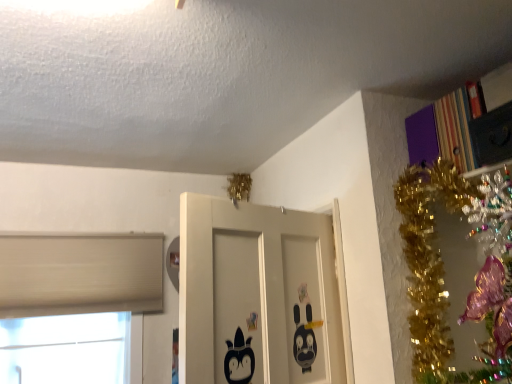
Where is `white matte window at lower left`? This screenshot has width=512, height=384. white matte window at lower left is located at coordinates (80, 273).

The image size is (512, 384). I want to click on black matte door at center, so click(x=256, y=290).

Would you say striped cardboard bookcase at upper right is a long distance from black matte door at center?

No.

From a real-world perspective, is striped cardboard bookcase at upper right located beneath black matte door at center?

No, from a real-world perspective, striped cardboard bookcase at upper right is not under black matte door at center.

Would you say striped cardboard bookcase at upper right contains black matte door at center?

No, striped cardboard bookcase at upper right does not contain black matte door at center.

Is striped cardboard bookcase at upper right outside of white matte window at lower left?

Yes.

Considering the positions of point (508, 65) and point (118, 244), is point (508, 65) closer or farther from the camera than point (118, 244)?

Point (508, 65) is positioned closer to the camera compared to point (118, 244).

Is striped cardboard bookcase at upper right far from white matte window at lower left?

striped cardboard bookcase at upper right is far away from white matte window at lower left.

This screenshot has width=512, height=384. Identify the location of bookcase on the right side of white matte window at lower left. (443, 131).

Is white matte window at lower left closer to camera compared to striped cardboard bookcase at upper right?

No, it is behind striped cardboard bookcase at upper right.

Is white matte window at lower left wider or thinner than striped cardboard bookcase at upper right?

Considering their sizes, white matte window at lower left looks slimmer than striped cardboard bookcase at upper right.

Based on the photo, is white matte window at lower left positioned far away from striped cardboard bookcase at upper right?

Absolutely, white matte window at lower left is distant from striped cardboard bookcase at upper right.

From a real-world perspective, which is physically above, black matte door at center or white matte window at lower left?

In real-world perspective, black matte door at center is above.

Which of these two, black matte door at center or white matte window at lower left, stands taller?

With more height is white matte window at lower left.

Is black matte door at center wider than white matte window at lower left?

Yes.

Between black matte door at center and white matte window at lower left, which one has larger size?

black matte door at center.

Looking at this image, is black matte door at center located within white matte window at lower left?

That's incorrect, black matte door at center is not inside white matte window at lower left.

Considering the positions of objects white matte window at lower left and black matte door at center in the image provided, who is more to the left, white matte window at lower left or black matte door at center?

white matte window at lower left.

Is point (31, 254) behind point (327, 289)?

Yes.

At what (x,y) coordinates should I click in order to perform the action: click on bookcase lying on the right of black matte door at center. Please return your answer as a coordinate pair (x, y). The image size is (512, 384). Looking at the image, I should click on (443, 131).

From a real-world perspective, which is physically above, black matte door at center or striped cardboard bookcase at upper right?

striped cardboard bookcase at upper right, from a real-world perspective.

Between black matte door at center and striped cardboard bookcase at upper right, which one has larger width?

black matte door at center.

Looking at this image, is black matte door at center touching striped cardboard bookcase at upper right?

No, black matte door at center is not making contact with striped cardboard bookcase at upper right.

Identify the location of door that appears below the striped cardboard bookcase at upper right (from a real-world perspective). Image resolution: width=512 pixels, height=384 pixels. click(256, 290).

This screenshot has width=512, height=384. Find the location of `bookcase lying in front of the white matte window at lower left`. bookcase lying in front of the white matte window at lower left is located at coordinates (443, 131).

Based on their spatial positions, is black matte door at center or striped cardboard bookcase at upper right closer to white matte window at lower left?

Among the two, black matte door at center is located nearer to white matte window at lower left.

From the image, which object appears to be farther from black matte door at center, white matte window at lower left or striped cardboard bookcase at upper right?

The object further to black matte door at center is white matte window at lower left.

When comparing their distances from striped cardboard bookcase at upper right, does black matte door at center or white matte window at lower left seem further?

white matte window at lower left is further to striped cardboard bookcase at upper right.

Which object lies further to the anchor point black matte door at center, striped cardboard bookcase at upper right or white matte window at lower left?

The object further to black matte door at center is white matte window at lower left.

Based on their spatial positions, is white matte window at lower left or black matte door at center closer to striped cardboard bookcase at upper right?

black matte door at center is positioned closer to the anchor striped cardboard bookcase at upper right.

From the image, which object appears to be farther from white matte window at lower left, striped cardboard bookcase at upper right or black matte door at center?

Among the two, striped cardboard bookcase at upper right is located further to white matte window at lower left.

You are a GUI agent. You are given a task and a screenshot of the screen. Output one action in this format:
    pyautogui.click(x=<x>, y=<y>)
    Task: Click on the door between white matte window at lower left and striped cardboard bookcase at upper right in the horizontal direction
    The height and width of the screenshot is (384, 512).
    Given the screenshot: What is the action you would take?
    pyautogui.click(x=256, y=290)